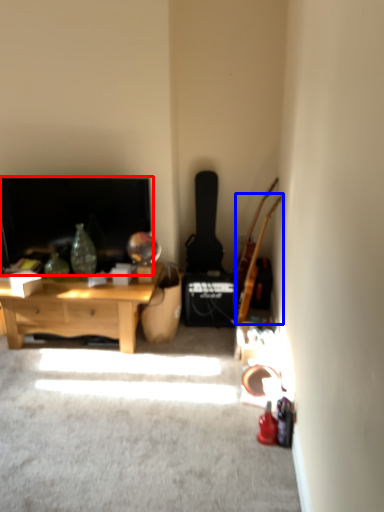
Question: Which object appears closest to the camera in this image, fireplace (highlighted by a red box) or guitar (highlighted by a blue box)?

Choices:
 (A) fireplace
 (B) guitar

Answer: (B)